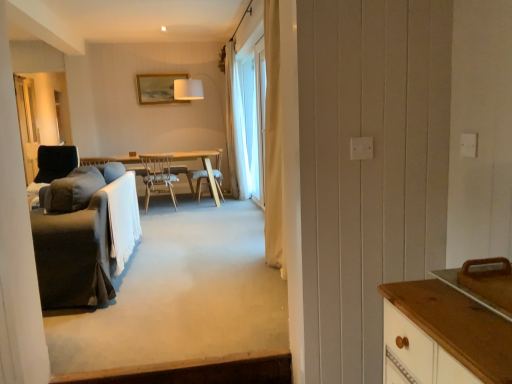
Locate an element on the screen. free region on the left part of white sheer curtain at center is located at coordinates tap(236, 215).